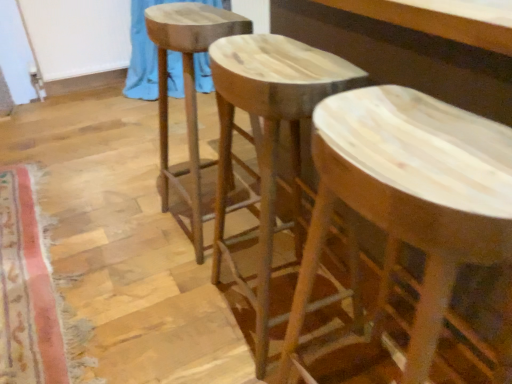
This screenshot has width=512, height=384. What are the coordinates of `natural wood stool at center, which is the 1th stool in left-to-right order` in the screenshot? It's located at (187, 90).

Would you say natural wood stool at center, the 3th stool viewed from the left, is outside carpeted mat at lower left?

Yes, natural wood stool at center, the 3th stool viewed from the left, is outside of carpeted mat at lower left.

This screenshot has width=512, height=384. In the image, there is a natural wood stool at center, arranged as the 1th stool when viewed from the right. In order to click on mat below it (from a real-world perspective) in this screenshot , I will do (26, 291).

What's the angular difference between natural wood stool at center, arranged as the 1th stool when viewed from the right, and carpeted mat at lower left's facing directions?

The facing directions of natural wood stool at center, arranged as the 1th stool when viewed from the right, and carpeted mat at lower left are 178 degrees apart.

Is natural wood stool at center, arranged as the 1th stool when viewed from the right, oriented away from carpeted mat at lower left?

No, natural wood stool at center, arranged as the 1th stool when viewed from the right, is not facing the opposite direction of carpeted mat at lower left.

Is there a large distance between natural wood stool at center, which is the 1th stool in left-to-right order, and natural wood stool at center, the 2th stool positioned from the right?

No, natural wood stool at center, which is the 1th stool in left-to-right order, is in close proximity to natural wood stool at center, the 2th stool positioned from the right.

Is natural wood stool at center, marked as the second stool in a left-to-right arrangement, inside natural wood stool at center, which is the 1th stool in left-to-right order?

No, natural wood stool at center, marked as the second stool in a left-to-right arrangement, is not a part of natural wood stool at center, which is the 1th stool in left-to-right order.

Consider the image. Can you confirm if natural wood stool at center, which is the 1th stool in left-to-right order, is positioned to the left of natural wood stool at center, marked as the second stool in a left-to-right arrangement?

Yes, natural wood stool at center, which is the 1th stool in left-to-right order, is to the left of natural wood stool at center, marked as the second stool in a left-to-right arrangement.

Based on the photo, from a real-world perspective, is natural wood stool at center, which is the 1th stool in left-to-right order, located beneath natural wood stool at center, marked as the second stool in a left-to-right arrangement?

No.

Which is closer, (x=211, y=87) or (x=294, y=228)?

The point (x=294, y=228) is closer.

Is blue fabric at upper left at the left side of natural wood stool at center, the 2th stool positioned from the right?

Yes.

From a real-world perspective, who is located higher, blue fabric at upper left or natural wood stool at center, the 2th stool positioned from the right?

natural wood stool at center, the 2th stool positioned from the right.

Is natural wood stool at center, the third stool positioned from the right, oriented towards blue fabric at upper left?

No.

Based on the photo, measure the distance from natural wood stool at center, which is the 1th stool in left-to-right order, to blue fabric at upper left.

natural wood stool at center, which is the 1th stool in left-to-right order, and blue fabric at upper left are 1.24 meters apart.

Is natural wood stool at center, which is the 1th stool in left-to-right order, inside or outside of blue fabric at upper left?

natural wood stool at center, which is the 1th stool in left-to-right order, lies outside blue fabric at upper left.

Which is in front, blue fabric at upper left or natural wood stool at center, which is the 1th stool in left-to-right order?

natural wood stool at center, which is the 1th stool in left-to-right order.

Image resolution: width=512 pixels, height=384 pixels. In the image, there is a natural wood stool at center, the third stool positioned from the right. In order to click on curtain below it (from a real-world perspective) in this screenshot , I will do `click(147, 51)`.

From the picture: Looking at the image, does blue fabric at upper left seem bigger or smaller compared to natural wood stool at center, which is the 1th stool in left-to-right order?

Clearly, blue fabric at upper left is larger in size than natural wood stool at center, which is the 1th stool in left-to-right order.

What's the angular difference between blue fabric at upper left and natural wood stool at center, which is the 1th stool in left-to-right order,'s facing directions?

The angular difference between blue fabric at upper left and natural wood stool at center, which is the 1th stool in left-to-right order, is 91.3 degrees.

From a real-world perspective, is natural wood stool at center, arranged as the 1th stool when viewed from the right, physically located above or below blue fabric at upper left?

In terms of real-world spatial position, natural wood stool at center, arranged as the 1th stool when viewed from the right, is above blue fabric at upper left.

Which of these two, natural wood stool at center, the 3th stool viewed from the left, or blue fabric at upper left, is thinner?

With smaller width is natural wood stool at center, the 3th stool viewed from the left.

The image size is (512, 384). I want to click on curtain behind the natural wood stool at center, arranged as the 1th stool when viewed from the right, so click(147, 51).

What's the angular difference between natural wood stool at center, the 3th stool viewed from the left, and blue fabric at upper left's facing directions?

natural wood stool at center, the 3th stool viewed from the left, and blue fabric at upper left are facing 88.9 degrees away from each other.

Would you say carpeted mat at lower left is a long distance from blue fabric at upper left?

Yes, carpeted mat at lower left is far from blue fabric at upper left.

Which of these two, carpeted mat at lower left or blue fabric at upper left, stands taller?

blue fabric at upper left.

Is carpeted mat at lower left facing towards blue fabric at upper left?

No, carpeted mat at lower left does not turn towards blue fabric at upper left.

I want to click on mat lying below the blue fabric at upper left (from the image's perspective), so click(26, 291).

The width and height of the screenshot is (512, 384). Find the location of `mat above the natural wood stool at center, the 3th stool viewed from the left (from the image's perspective)`. mat above the natural wood stool at center, the 3th stool viewed from the left (from the image's perspective) is located at coordinates (26, 291).

There is a natural wood stool at center, marked as the second stool in a left-to-right arrangement. In order to click on the 2nd stool above it (from a real-world perspective) in this screenshot , I will do `click(187, 90)`.

From the image, which object appears to be nearer to natural wood stool at center, marked as the second stool in a left-to-right arrangement, natural wood stool at center, the 3th stool viewed from the left, or blue fabric at upper left?

natural wood stool at center, the 3th stool viewed from the left, lies closer to natural wood stool at center, marked as the second stool in a left-to-right arrangement, than the other object.

Considering their positions, is natural wood stool at center, the 3th stool viewed from the left, positioned closer to natural wood stool at center, the 2th stool positioned from the right, than carpeted mat at lower left?

natural wood stool at center, the 3th stool viewed from the left, lies closer to natural wood stool at center, the 2th stool positioned from the right, than the other object.

Considering their positions, is natural wood stool at center, marked as the second stool in a left-to-right arrangement, positioned closer to natural wood stool at center, arranged as the 1th stool when viewed from the right, than blue fabric at upper left?

Among the two, natural wood stool at center, marked as the second stool in a left-to-right arrangement, is located nearer to natural wood stool at center, arranged as the 1th stool when viewed from the right.

Which object lies further to the anchor point natural wood stool at center, the third stool positioned from the right, natural wood stool at center, arranged as the 1th stool when viewed from the right, or blue fabric at upper left?

blue fabric at upper left is positioned further to the anchor natural wood stool at center, the third stool positioned from the right.

Looking at the image, which one is located closer to natural wood stool at center, which is the 1th stool in left-to-right order, blue fabric at upper left or carpeted mat at lower left?

carpeted mat at lower left is positioned closer to the anchor natural wood stool at center, which is the 1th stool in left-to-right order.

When comparing their distances from natural wood stool at center, which is the 1th stool in left-to-right order, does natural wood stool at center, the 3th stool viewed from the left, or natural wood stool at center, marked as the second stool in a left-to-right arrangement, seem closer?

The object closer to natural wood stool at center, which is the 1th stool in left-to-right order, is natural wood stool at center, marked as the second stool in a left-to-right arrangement.

Considering their positions, is carpeted mat at lower left positioned further to natural wood stool at center, arranged as the 1th stool when viewed from the right, than natural wood stool at center, which is the 1th stool in left-to-right order?

The object further to natural wood stool at center, arranged as the 1th stool when viewed from the right, is carpeted mat at lower left.

Which object lies further to the anchor point natural wood stool at center, the 3th stool viewed from the left, natural wood stool at center, the third stool positioned from the right, or blue fabric at upper left?

blue fabric at upper left is further to natural wood stool at center, the 3th stool viewed from the left.

This screenshot has width=512, height=384. I want to click on stool between carpeted mat at lower left and blue fabric at upper left in the front-back direction, so (187, 90).

Locate an element on the screen. The width and height of the screenshot is (512, 384). mat between natural wood stool at center, marked as the second stool in a left-to-right arrangement, and blue fabric at upper left in the front-back direction is located at coordinates (26, 291).

This screenshot has width=512, height=384. I want to click on stool between natural wood stool at center, the 2th stool positioned from the right, and blue fabric at upper left in the front-back direction, so click(x=187, y=90).

You are a GUI agent. You are given a task and a screenshot of the screen. Output one action in this format:
    pyautogui.click(x=<x>, y=<y>)
    Task: Click on the stool positioned between natural wood stool at center, arranged as the 1th stool when viewed from the right, and natural wood stool at center, the third stool positioned from the right, from near to far
    
    Given the screenshot: What is the action you would take?
    pyautogui.click(x=267, y=147)